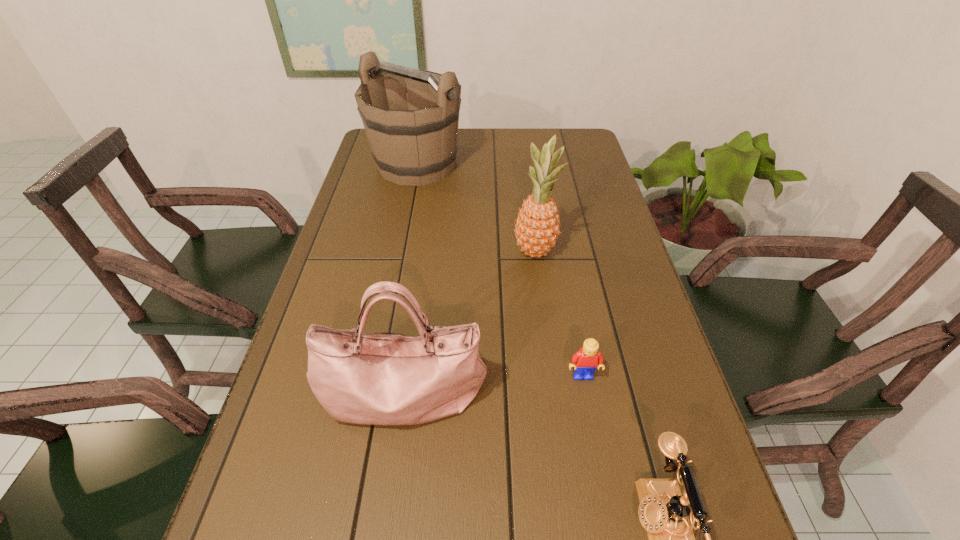
Where is `object situated at the right edge`? The height and width of the screenshot is (540, 960). object situated at the right edge is located at coordinates (585, 361).

At what (x,y) coordinates should I click in order to perform the action: click on object that is positioned at the far left corner. Please return your answer as a coordinate pair (x, y). This screenshot has width=960, height=540. Looking at the image, I should click on (413, 141).

The width and height of the screenshot is (960, 540). In the image, there is a desktop. Find the location of `blank space at the far edge`. blank space at the far edge is located at coordinates (524, 146).

The width and height of the screenshot is (960, 540). I want to click on vacant area at the left edge, so click(253, 507).

Locate an element on the screen. The image size is (960, 540). vacant space at the right edge is located at coordinates (567, 176).

What are the coordinates of `free spot between the bucket and the pineapple` in the screenshot? It's located at (476, 208).

I want to click on free space that is in between the second farthest object and the shortest object, so click(559, 313).

Locate an element on the screen. unoccupied position between the farthest object and the shortest object is located at coordinates (500, 270).

Find the location of `free space between the handbag and the pineapple`. free space between the handbag and the pineapple is located at coordinates (468, 322).

Locate which object is the third closest to the pineapple. Please provide its 2D coordinates. Your answer should be formatted as a tuple, i.e. [(x, y)], where the tuple contains the x and y coordinates of a point satisfying the conditions above.

[(585, 361)]